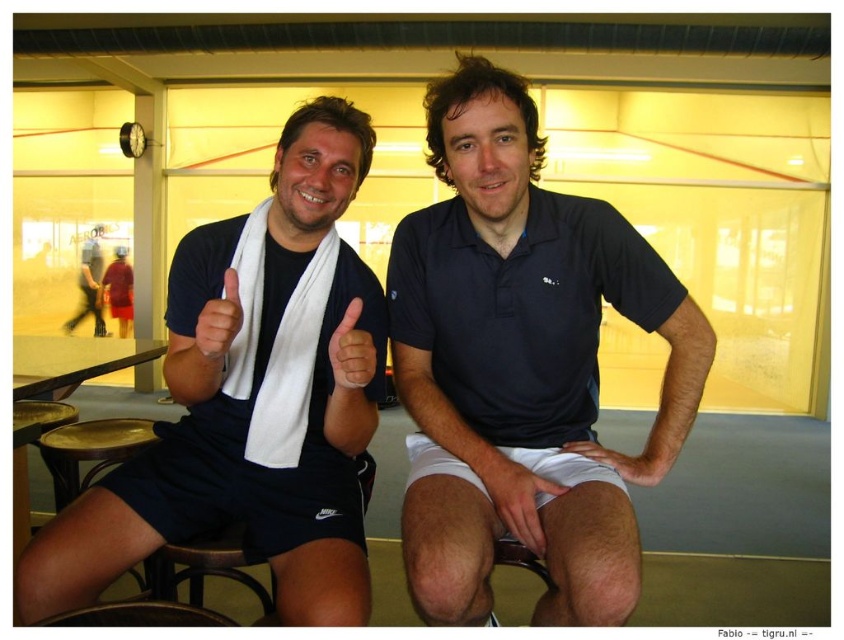
From the picture: You are a photographer setting up a shoot in this gym scene. You need to position a small light source between the matte white towel at upper center and the dark blue shorts at center. Based on their positions, which object should the light be closer to?

The matte white towel at upper center is in front of the dark blue shorts at center, so the light should be placed closer to the matte white towel at upper center to ensure proper illumination.

You are designing a fitness app that tracks body measurements. You need to determine which object in the image is larger in size between the dark blue polo shirt at center and the white matte hand at center. Based on the scene, which one is larger?

The dark blue polo shirt at center is bigger than the white matte hand at center, so the dark blue polo shirt at center is larger in size.

You are a photographer setting up a photo shoot in the gym. You need to position a spotlight so that it illuminates both the dark blue polo shirt at center and the white matte hand at center without casting shadows on the background. Given their relative heights, where should you place the spotlight?

The dark blue polo shirt at center is taller than the white matte hand at center. To avoid casting shadows on the background, position the spotlight above and slightly behind the dark blue polo shirt at center, ensuring it illuminates both objects while keeping the light source high enough to prevent shadows from either object reaching the background.